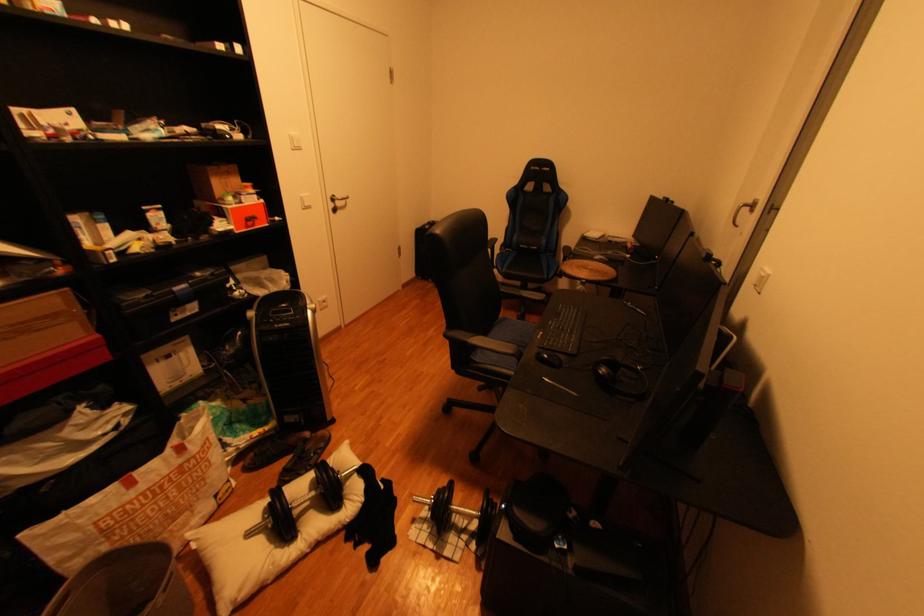
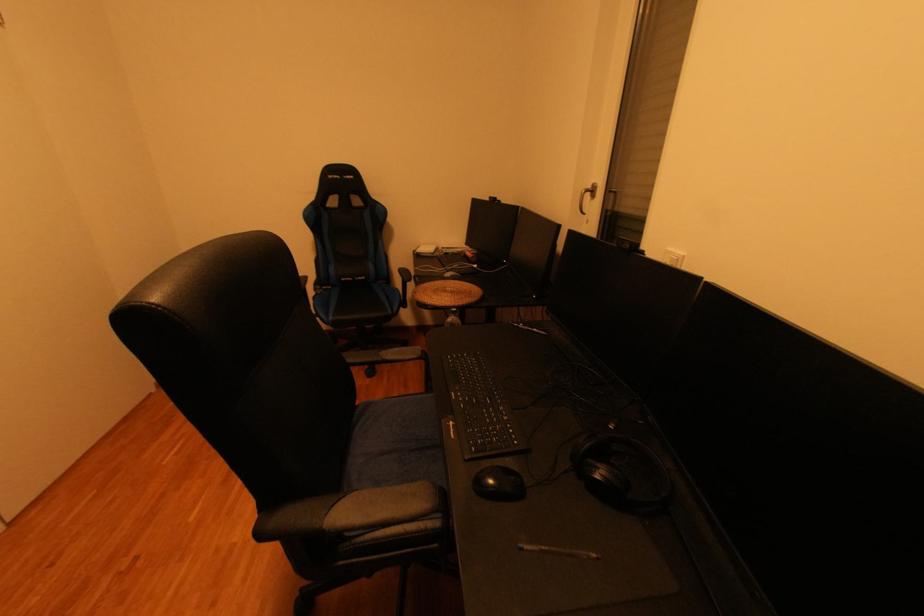
Question: Based on the continuous images, in which direction is the camera rotating? Reply with the corresponding letter.

Choices:
 (A) Left
 (B) Right
 (C) Up
 (D) Down

Answer: (B)